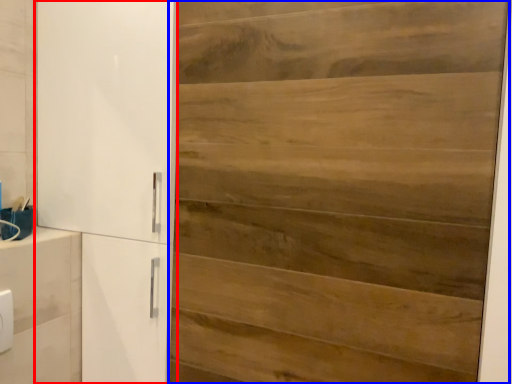
Question: Which object is closer to the camera taking this photo, cupboard (highlighted by a red box) or door (highlighted by a blue box)?

Choices:
 (A) cupboard
 (B) door

Answer: (B)